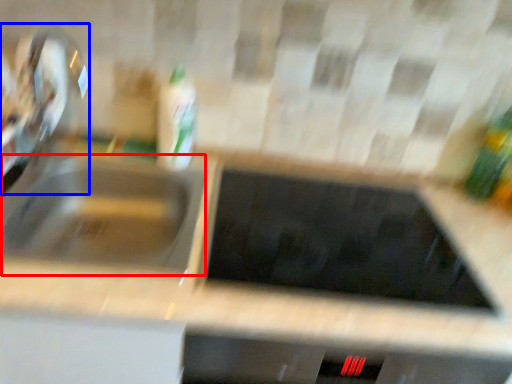
Question: Which point is closer to the camera, sink (highlighted by a red box) or faucet (highlighted by a blue box)?

Choices:
 (A) sink
 (B) faucet

Answer: (A)